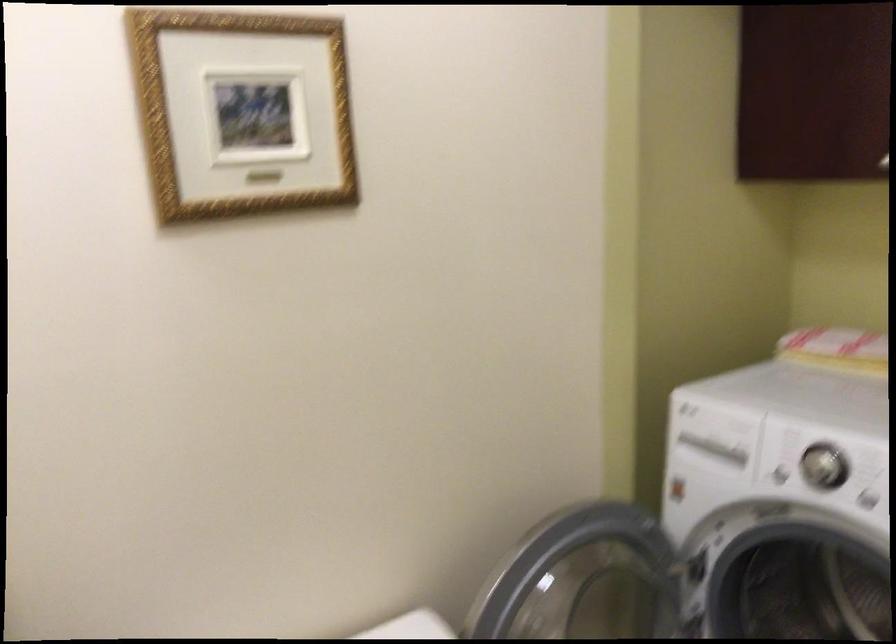
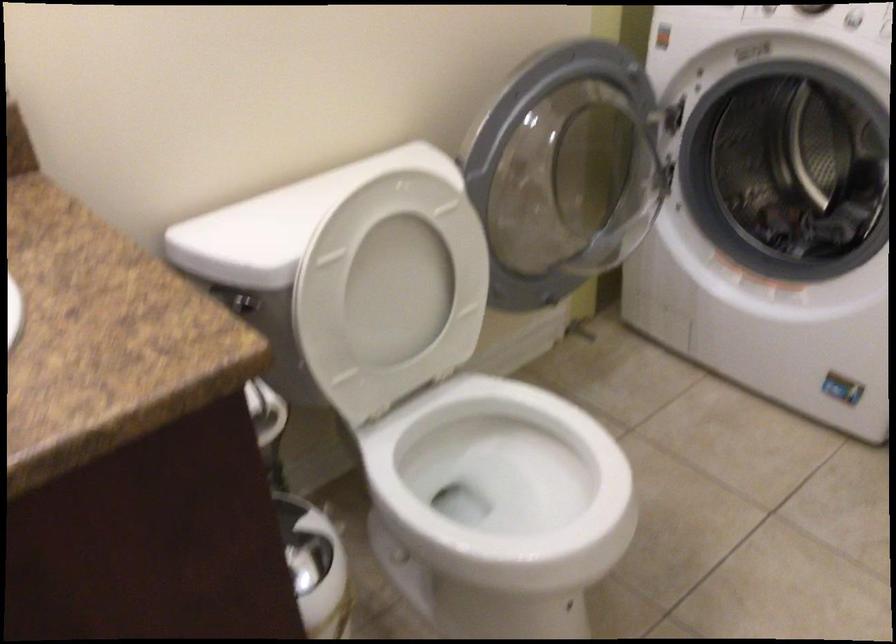
The images are taken continuously from a first-person perspective. In which direction are you moving?

The movement direction of the cameraman is left, backward.